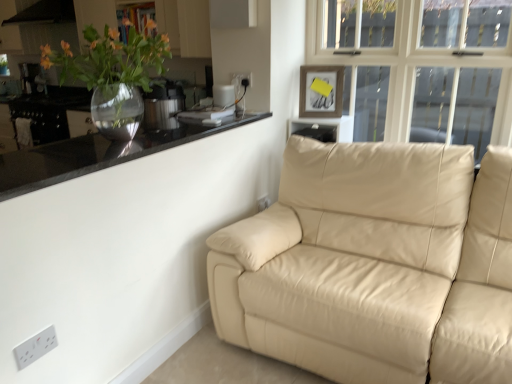
Question: Would you say wooden picture frame at upper center is outside satin silver pressure cooker at upper left, the second appliance viewed from the back?

Choices:
 (A) no
 (B) yes

Answer: (B)

Question: Is wooden picture frame at upper center at the left side of satin silver pressure cooker at upper left, which is the first appliance in bottom-to-top order?

Choices:
 (A) yes
 (B) no

Answer: (B)

Question: Is wooden picture frame at upper center looking in the opposite direction of satin silver pressure cooker at upper left, which is counted as the second appliance, starting from the top?

Choices:
 (A) no
 (B) yes

Answer: (A)

Question: Is wooden picture frame at upper center closer to camera compared to satin silver pressure cooker at upper left, which is counted as the second appliance, starting from the top?

Choices:
 (A) yes
 (B) no

Answer: (B)

Question: Is wooden picture frame at upper center beside satin silver pressure cooker at upper left, which is the second appliance in left-to-right order?

Choices:
 (A) yes
 (B) no

Answer: (B)

Question: Does point (28, 354) appear closer or farther from the camera than point (218, 125)?

Choices:
 (A) closer
 (B) farther

Answer: (A)

Question: Considering the relative positions of white plastic electric outlet at lower left, which is the 3th electric outlet from back to front, and black glossy countertop at upper left in the image provided, is white plastic electric outlet at lower left, which is the 3th electric outlet from back to front, to the left or to the right of black glossy countertop at upper left?

Choices:
 (A) left
 (B) right

Answer: (A)

Question: From a real-world perspective, is white plastic electric outlet at lower left, marked as the 1th electric outlet in a left-to-right arrangement, physically located above or below black glossy countertop at upper left?

Choices:
 (A) above
 (B) below

Answer: (B)

Question: Is white plastic electric outlet at lower left, which is the 3th electric outlet from top to bottom, in front of or behind black glossy countertop at upper left in the image?

Choices:
 (A) front
 (B) behind

Answer: (B)

Question: Visually, is black matte exhaust hood at upper left positioned to the left or to the right of white plastic electric outlet at upper center, acting as the 2th electric outlet starting from the back?

Choices:
 (A) right
 (B) left

Answer: (B)

Question: From a real-world perspective, is black matte exhaust hood at upper left physically located above or below white plastic electric outlet at upper center, acting as the 2th electric outlet starting from the back?

Choices:
 (A) below
 (B) above

Answer: (B)

Question: From the image's perspective, is black matte exhaust hood at upper left located above or below white plastic electric outlet at upper center, the second electric outlet from the right?

Choices:
 (A) below
 (B) above

Answer: (B)

Question: Relative to white plastic electric outlet at upper center, the second electric outlet viewed from the front, is black matte exhaust hood at upper left in front or behind?

Choices:
 (A) behind
 (B) front

Answer: (A)

Question: In terms of height, does white plastic electric outlet at lower center, the 2th electric outlet viewed from the top, look taller or shorter compared to black matte exhaust hood at upper left?

Choices:
 (A) tall
 (B) short

Answer: (B)

Question: Relative to black matte exhaust hood at upper left, is white plastic electric outlet at lower center, the 1th electric outlet in the back-to-front sequence, in front or behind?

Choices:
 (A) behind
 (B) front

Answer: (B)